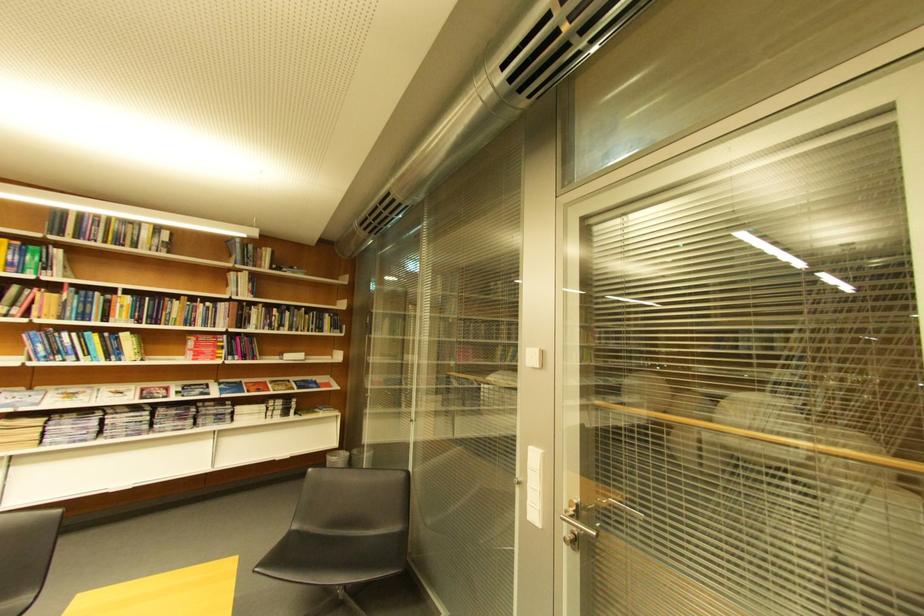
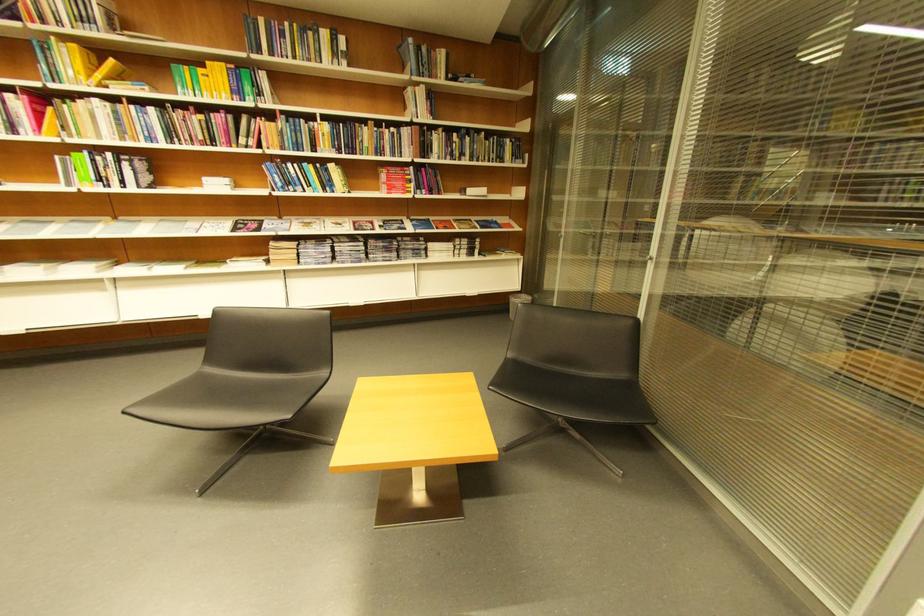
Where in the second image is the point corresponding to point (213, 339) from the first image?

(403, 172)